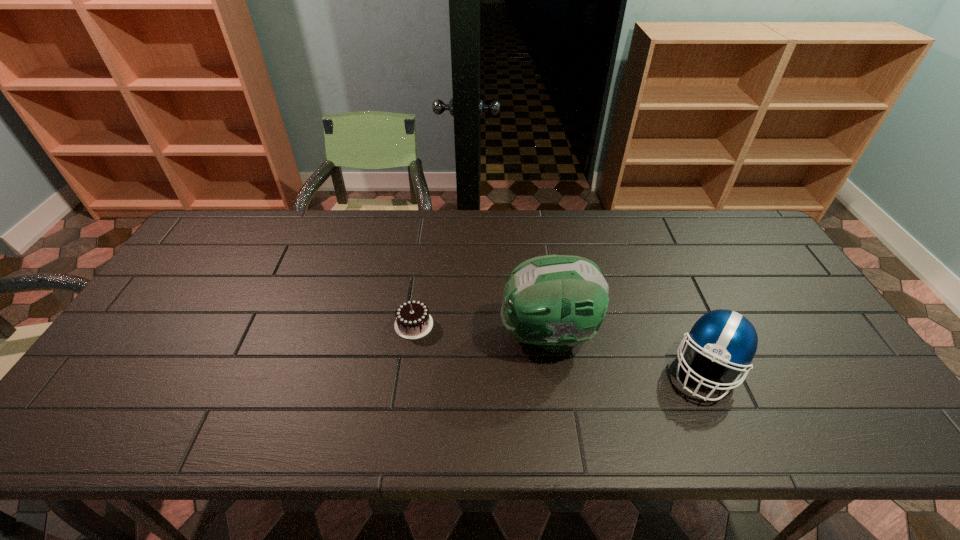
Locate an element on the screen. The image size is (960, 540). free space that is in between the leftmost object and the left football helmet is located at coordinates (481, 330).

Where is `blank region between the leftmost object and the second object from right to left`? blank region between the leftmost object and the second object from right to left is located at coordinates (481, 330).

Where is `blank region between the shortest object and the tallest object`? This screenshot has width=960, height=540. blank region between the shortest object and the tallest object is located at coordinates (481, 330).

You are a GUI agent. You are given a task and a screenshot of the screen. Output one action in this format:
    pyautogui.click(x=<x>, y=<y>)
    Task: Click on the free space between the taller football helmet and the chocolate cake
    The image size is (960, 540).
    Given the screenshot: What is the action you would take?
    pyautogui.click(x=481, y=330)

Identify the location of free spot between the shortest object and the tallest object. (481, 330).

Image resolution: width=960 pixels, height=540 pixels. I want to click on empty space that is in between the shorter football helmet and the taller football helmet, so click(x=627, y=352).

Where is `the second closest object to the second shortest object`? the second closest object to the second shortest object is located at coordinates (413, 321).

Find the location of `the closest object to the leftmost object`. the closest object to the leftmost object is located at coordinates (557, 302).